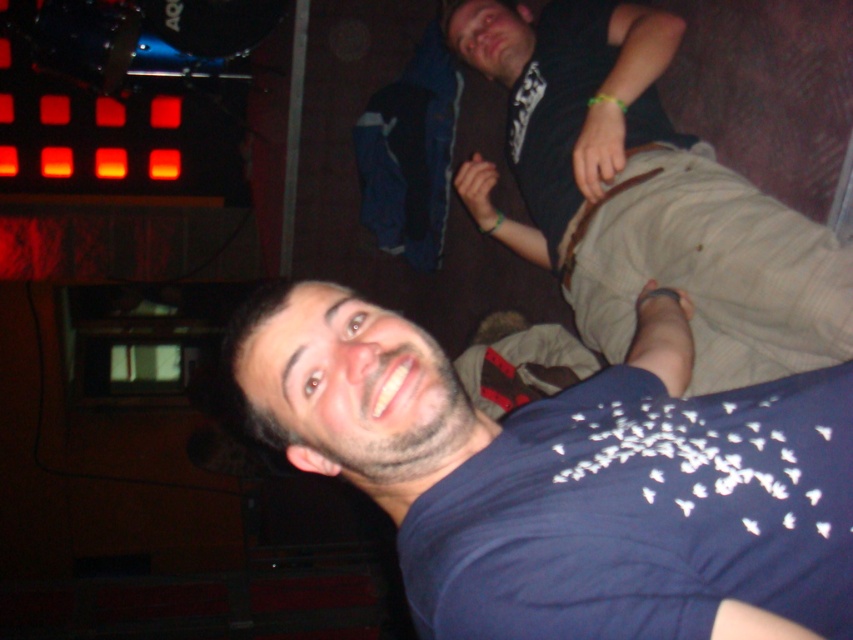
Is dark blue t-shirt at center smaller than khaki cotton pants at center?

Yes.

Consider the image. Who is more distant from viewer, (527, 442) or (566, 35)?

Positioned behind is point (566, 35).

The image size is (853, 640). What are the coordinates of `dark blue t-shirt at center` in the screenshot? It's located at (569, 480).